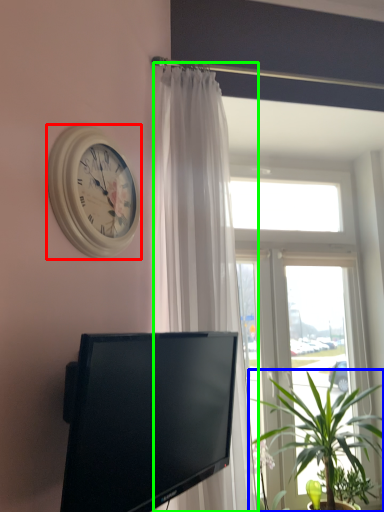
Question: Estimate the real-world distances between objects in this image. Which object is closer to wall clock (highlighted by a red box), houseplant (highlighted by a blue box) or curtain (highlighted by a green box)?

Choices:
 (A) houseplant
 (B) curtain

Answer: (B)